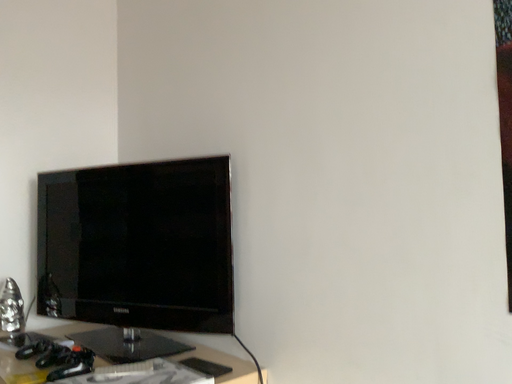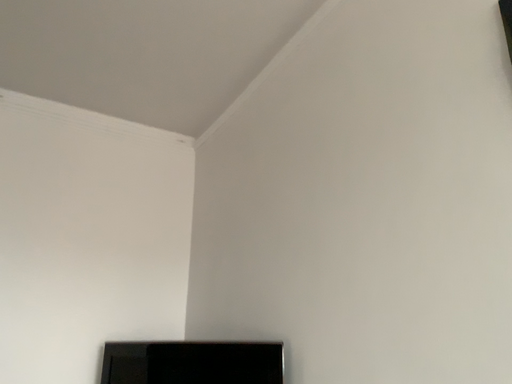
Question: How did the camera likely rotate when shooting the video?

Choices:
 (A) rotated right
 (B) rotated left

Answer: (B)